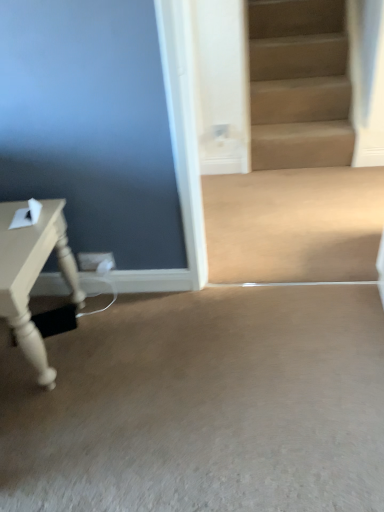
Question: From the image's perspective, is beige carpet at lower center, marked as the 2th concrete in a back-to-front arrangement, located beneath matte white table at left?

Choices:
 (A) no
 (B) yes

Answer: (B)

Question: Is matte white table at left completely or partially inside beige carpet at lower center, which ranks as the 1th concrete in front-to-back order?

Choices:
 (A) no
 (B) yes

Answer: (A)

Question: Does beige carpet at lower center, marked as the 2th concrete in a back-to-front arrangement, lie in front of matte white table at left?

Choices:
 (A) yes
 (B) no

Answer: (A)

Question: Does beige carpet at lower center, which ranks as the 1th concrete in front-to-back order, appear on the right side of matte white table at left?

Choices:
 (A) yes
 (B) no

Answer: (A)

Question: From a real-world perspective, is beige carpet at lower center, marked as the 2th concrete in a back-to-front arrangement, positioned under matte white table at left based on gravity?

Choices:
 (A) no
 (B) yes

Answer: (B)

Question: Would you say matte white table at left is to the left or to the right of beige smooth concrete at center, the second concrete in the bottom-to-top sequence, in the picture?

Choices:
 (A) right
 (B) left

Answer: (B)

Question: From a real-world perspective, is matte white table at left physically located above or below beige smooth concrete at center, the second concrete in the bottom-to-top sequence?

Choices:
 (A) above
 (B) below

Answer: (A)

Question: Is matte white table at left inside or outside of beige smooth concrete at center, which appears as the 1th concrete when viewed from the top?

Choices:
 (A) outside
 (B) inside

Answer: (A)

Question: Looking at the image, does matte white table at left seem bigger or smaller compared to beige smooth concrete at center, which appears as the 1th concrete when viewed from the top?

Choices:
 (A) big
 (B) small

Answer: (A)

Question: Considering the relative positions of beige smooth concrete at center, arranged as the 2th concrete when viewed from the front, and beige carpet at lower center, marked as the 2th concrete in a back-to-front arrangement, in the image provided, is beige smooth concrete at center, arranged as the 2th concrete when viewed from the front, to the left or to the right of beige carpet at lower center, marked as the 2th concrete in a back-to-front arrangement,?

Choices:
 (A) left
 (B) right

Answer: (B)

Question: Considering their positions, is beige smooth concrete at center, the second concrete in the bottom-to-top sequence, located in front of or behind beige carpet at lower center, which ranks as the 1th concrete in front-to-back order?

Choices:
 (A) front
 (B) behind

Answer: (B)

Question: In terms of height, does beige smooth concrete at center, the second concrete in the bottom-to-top sequence, look taller or shorter compared to beige carpet at lower center, which ranks as the 1th concrete in front-to-back order?

Choices:
 (A) tall
 (B) short

Answer: (B)

Question: Is beige smooth concrete at center, arranged as the 2th concrete when viewed from the front, wider or thinner than beige carpet at lower center, marked as the 2th concrete in a back-to-front arrangement?

Choices:
 (A) wide
 (B) thin

Answer: (B)

Question: Is beige carpet at lower center, which ranks as the 1th concrete in front-to-back order, in front of or behind matte white table at left in the image?

Choices:
 (A) behind
 (B) front

Answer: (B)

Question: Based on their sizes in the image, would you say beige carpet at lower center, which is counted as the first concrete, starting from the bottom, is bigger or smaller than matte white table at left?

Choices:
 (A) small
 (B) big

Answer: (B)